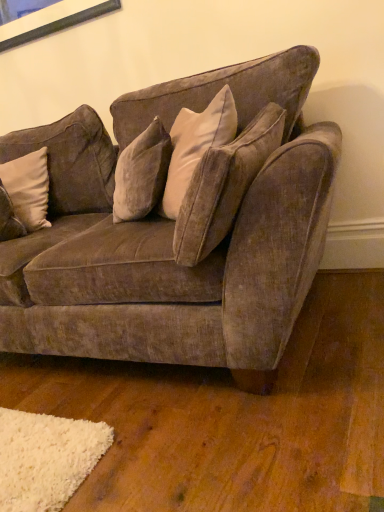
Question: Does beige velvet pillow at left have a larger size compared to velvet brown couch at center?

Choices:
 (A) yes
 (B) no

Answer: (B)

Question: Is there a large distance between beige velvet pillow at left and velvet brown couch at center?

Choices:
 (A) no
 (B) yes

Answer: (A)

Question: Is beige velvet pillow at left to the left of velvet brown couch at center from the viewer's perspective?

Choices:
 (A) yes
 (B) no

Answer: (A)

Question: Can you confirm if beige velvet pillow at left is thinner than velvet brown couch at center?

Choices:
 (A) no
 (B) yes

Answer: (B)

Question: Is beige velvet pillow at left in front of velvet brown couch at center?

Choices:
 (A) yes
 (B) no

Answer: (B)

Question: Does beige velvet pillow at left have a smaller size compared to velvet brown couch at center?

Choices:
 (A) yes
 (B) no

Answer: (A)

Question: Is velvet brown couch at center oriented towards beige velvet pillow at left?

Choices:
 (A) yes
 (B) no

Answer: (A)

Question: From a real-world perspective, is velvet brown couch at center positioned over beige velvet pillow at left based on gravity?

Choices:
 (A) no
 (B) yes

Answer: (A)

Question: Is velvet brown couch at center at the right side of beige velvet pillow at left?

Choices:
 (A) no
 (B) yes

Answer: (B)

Question: Is beige velvet pillow at left completely or partially inside velvet brown couch at center?

Choices:
 (A) yes
 (B) no

Answer: (A)

Question: Can you confirm if velvet brown couch at center is smaller than beige velvet pillow at left?

Choices:
 (A) no
 (B) yes

Answer: (A)

Question: Would you say velvet brown couch at center is a long distance from beige velvet pillow at left?

Choices:
 (A) no
 (B) yes

Answer: (A)

Question: From a real-world perspective, is velvet brown couch at center physically located above or below beige velvet pillow at left?

Choices:
 (A) below
 (B) above

Answer: (A)